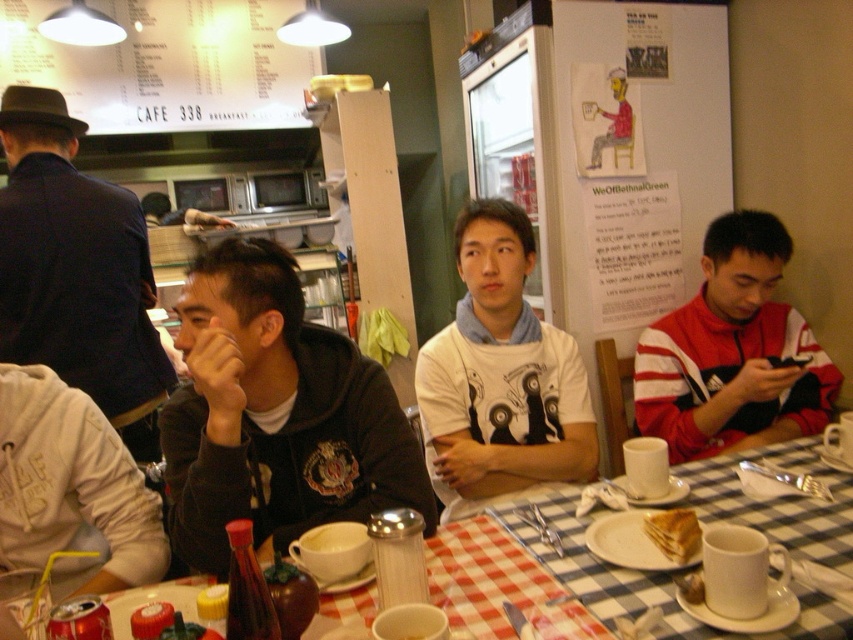
You are a customer at CAFE 338 and you want to place your golden crispy pastry at lower center on the table without touching the checkered fabric tablecloth at lower center. Is this possible?

The checkered fabric tablecloth at lower center is positioned under the golden crispy pastry at lower center, so it is already covering the table. Since the pastry is on top of the tablecloth, placing it without touching the tablecloth would require an alternative surface, but there is no mention of another surface available. Therefore, it is not possible.

You are sitting at the table in the cafe and want to reach both the point at coordinates (705, 472) and the point at coordinates (598, 602). Which point will you reach first if you extend your arm straight out?

You will reach the point at coordinates (705, 472) first because it is closer to you than the point at coordinates (598, 602), which is further away.